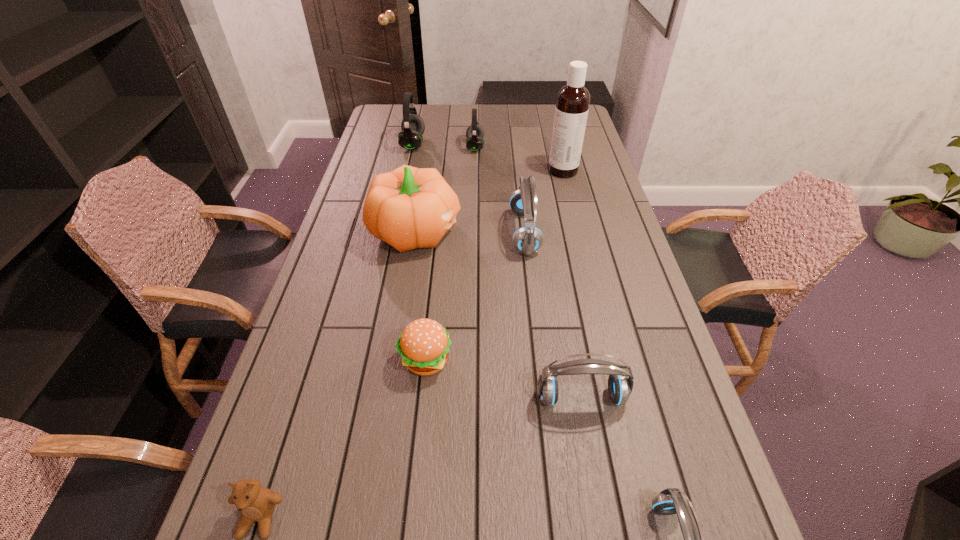
Locate which object is the fourth closest to the left black headset. Please provide its 2D coordinates. Your answer should be formatted as a tuple, i.e. [(x, y)], where the tuple contains the x and y coordinates of a point satisfying the conditions above.

[(572, 105)]

Identify which headset is the fifth closest to the third farthest object. Please provide its 2D coordinates. Your answer should be formatted as a tuple, i.e. [(x, y)], where the tuple contains the x and y coordinates of a point satisfying the conditions above.

[(667, 502)]

The image size is (960, 540). I want to click on the second closest headset relative to the biggest blue headset, so click(x=620, y=387).

Identify the location of the closest blue headset to the leftmost object. Image resolution: width=960 pixels, height=540 pixels. (620, 387).

Identify which blue headset is the nearest to the smaller black headset. Please provide its 2D coordinates. Your answer should be formatted as a tuple, i.e. [(x, y)], where the tuple contains the x and y coordinates of a point satisfying the conditions above.

[(527, 239)]

The image size is (960, 540). In order to click on vacant space that satisfies the following two spatial constraints: 1. on the ear cups of the leftmost headset; 2. on the back side of the sixth farthest object in this screenshot , I will do `click(366, 360)`.

In order to click on free spot that satisfies the following two spatial constraints: 1. on the label side of the dishwasher detergent; 2. on the front side of the hamburger in this screenshot , I will do `click(610, 360)`.